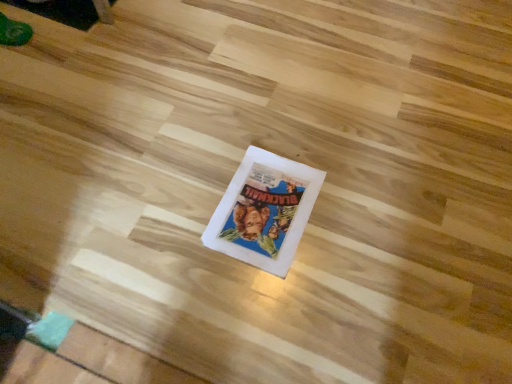
The width and height of the screenshot is (512, 384). Identify the location of empty space that is ontop of white paper comic book at center (from a real-world perspective). (272, 200).